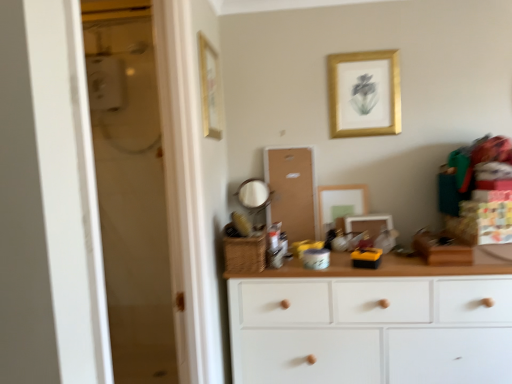
Question: Which direction should I rotate to face matte gold picture frame at center, the 2th picture frame when ordered from left to right, — up or down?

Choices:
 (A) up
 (B) down

Answer: (B)

Question: Is matte white picture frame at center, positioned as the first picture frame in right-to-left order, further to camera compared to matte gold picture frame at center, which appears as the 3th picture frame when viewed from the right?

Choices:
 (A) yes
 (B) no

Answer: (B)

Question: Is matte white picture frame at center, positioned as the first picture frame in right-to-left order, thinner than matte gold picture frame at center, the 2th picture frame when ordered from left to right?

Choices:
 (A) no
 (B) yes

Answer: (A)

Question: From the image's perspective, is matte white picture frame at center, positioned as the fourth picture frame in left-to-right order, beneath matte gold picture frame at center, which appears as the 3th picture frame when viewed from the right?

Choices:
 (A) yes
 (B) no

Answer: (A)

Question: Could you tell me if matte white picture frame at center, positioned as the fourth picture frame in left-to-right order, is turned towards matte gold picture frame at center, which appears as the 3th picture frame when viewed from the right?

Choices:
 (A) yes
 (B) no

Answer: (B)

Question: From a real-world perspective, is matte white picture frame at center, positioned as the fourth picture frame in left-to-right order, located beneath matte gold picture frame at center, the 2th picture frame when ordered from left to right?

Choices:
 (A) yes
 (B) no

Answer: (A)

Question: Can you confirm if matte white picture frame at center, positioned as the fourth picture frame in left-to-right order, is shorter than matte gold picture frame at center, the 2th picture frame when ordered from left to right?

Choices:
 (A) no
 (B) yes

Answer: (B)

Question: From the image's perspective, does gold/golden frame at upper center, arranged as the third picture frame when viewed from the left, appear lower than matte gold picture frame at center, the 2th picture frame when ordered from left to right?

Choices:
 (A) no
 (B) yes

Answer: (A)

Question: Can we say gold/golden frame at upper center, which is the second picture frame in right-to-left order, lies outside matte gold picture frame at center, which appears as the 3th picture frame when viewed from the right?

Choices:
 (A) no
 (B) yes

Answer: (B)

Question: Does gold/golden frame at upper center, which is the second picture frame in right-to-left order, have a smaller size compared to matte gold picture frame at center, which appears as the 3th picture frame when viewed from the right?

Choices:
 (A) yes
 (B) no

Answer: (A)

Question: Considering the relative sizes of gold/golden frame at upper center, arranged as the third picture frame when viewed from the left, and matte gold picture frame at center, the 2th picture frame when ordered from left to right, in the image provided, is gold/golden frame at upper center, arranged as the third picture frame when viewed from the left, wider than matte gold picture frame at center, the 2th picture frame when ordered from left to right,?

Choices:
 (A) yes
 (B) no

Answer: (B)

Question: Is gold/golden frame at upper center, which is the second picture frame in right-to-left order, at the left side of matte gold picture frame at center, which appears as the 3th picture frame when viewed from the right?

Choices:
 (A) no
 (B) yes

Answer: (A)

Question: Can you confirm if gold/golden frame at upper center, which is the second picture frame in right-to-left order, is thinner than matte gold picture frame at center, which appears as the 3th picture frame when viewed from the right?

Choices:
 (A) no
 (B) yes

Answer: (B)

Question: Can you confirm if corkboard at center is smaller than matte white picture frame at center, positioned as the fourth picture frame in left-to-right order?

Choices:
 (A) no
 (B) yes

Answer: (A)